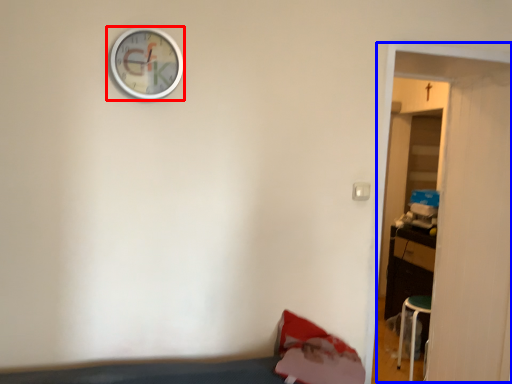
Question: Which of the following is the farthest to the observer, wall clock (highlighted by a red box) or door (highlighted by a blue box)?

Choices:
 (A) wall clock
 (B) door

Answer: (B)